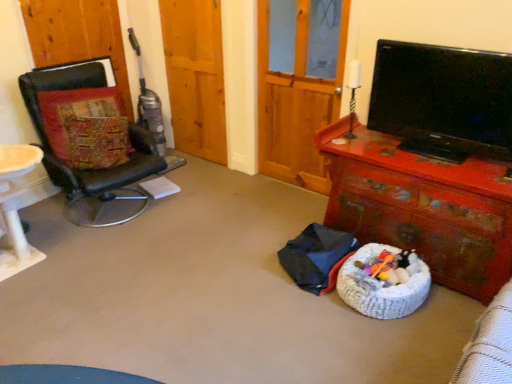
You are a GUI agent. You are given a task and a screenshot of the screen. Output one action in this format:
    pyautogui.click(x=<x>, y=<y>)
    Task: Click on the vacant space behind dark blue fabric at center
    
    Given the screenshot: What is the action you would take?
    pyautogui.click(x=283, y=221)